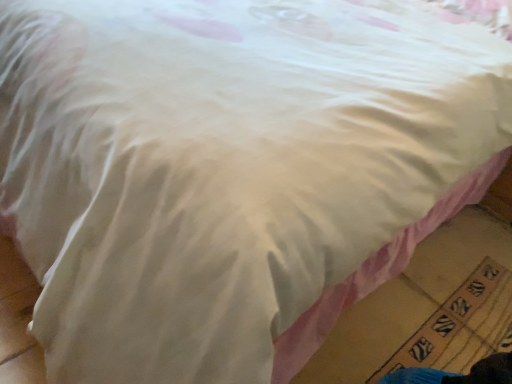
The image size is (512, 384). I want to click on free space above brown woven mat at lower right (from a real-world perspective), so click(x=471, y=323).